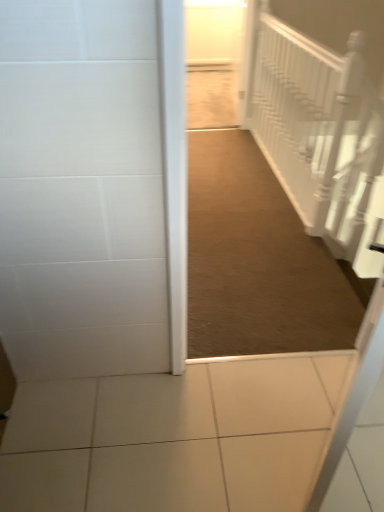
Question: Can you confirm if brown carpet at center is shorter than white textured stairwell at upper right?

Choices:
 (A) yes
 (B) no

Answer: (A)

Question: Does brown carpet at center appear on the left side of white textured stairwell at upper right?

Choices:
 (A) yes
 (B) no

Answer: (A)

Question: Considering the relative positions of brown carpet at center and white textured stairwell at upper right in the image provided, is brown carpet at center to the right of white textured stairwell at upper right from the viewer's perspective?

Choices:
 (A) no
 (B) yes

Answer: (A)

Question: From the image's perspective, does brown carpet at center appear lower than white textured stairwell at upper right?

Choices:
 (A) yes
 (B) no

Answer: (A)

Question: Is brown carpet at center positioned far away from white textured stairwell at upper right?

Choices:
 (A) yes
 (B) no

Answer: (B)

Question: From a real-world perspective, is brown carpet at center over white textured stairwell at upper right?

Choices:
 (A) yes
 (B) no

Answer: (B)

Question: From a real-world perspective, is white textured stairwell at upper right on top of brown carpet at center?

Choices:
 (A) yes
 (B) no

Answer: (A)

Question: Considering the relative sizes of white textured stairwell at upper right and brown carpet at center in the image provided, is white textured stairwell at upper right thinner than brown carpet at center?

Choices:
 (A) yes
 (B) no

Answer: (A)

Question: Is white textured stairwell at upper right wider than brown carpet at center?

Choices:
 (A) yes
 (B) no

Answer: (B)

Question: Considering the relative sizes of white textured stairwell at upper right and brown carpet at center in the image provided, is white textured stairwell at upper right smaller than brown carpet at center?

Choices:
 (A) no
 (B) yes

Answer: (A)

Question: Would you say white textured stairwell at upper right is outside brown carpet at center?

Choices:
 (A) yes
 (B) no

Answer: (A)

Question: Is the depth of white textured stairwell at upper right less than that of brown carpet at center?

Choices:
 (A) no
 (B) yes

Answer: (A)

Question: Is white textured stairwell at upper right taller or shorter than brown carpet at center?

Choices:
 (A) tall
 (B) short

Answer: (A)